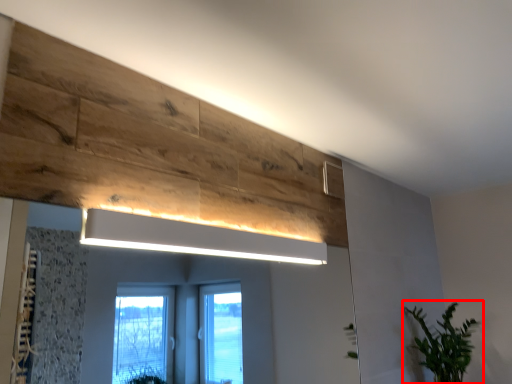
Question: From the image's perspective, considering the relative positions of houseplant (annotated by the red box) and light fixture in the image provided, where is houseplant (annotated by the red box) located with respect to the staircase?

Choices:
 (A) below
 (B) above

Answer: (A)